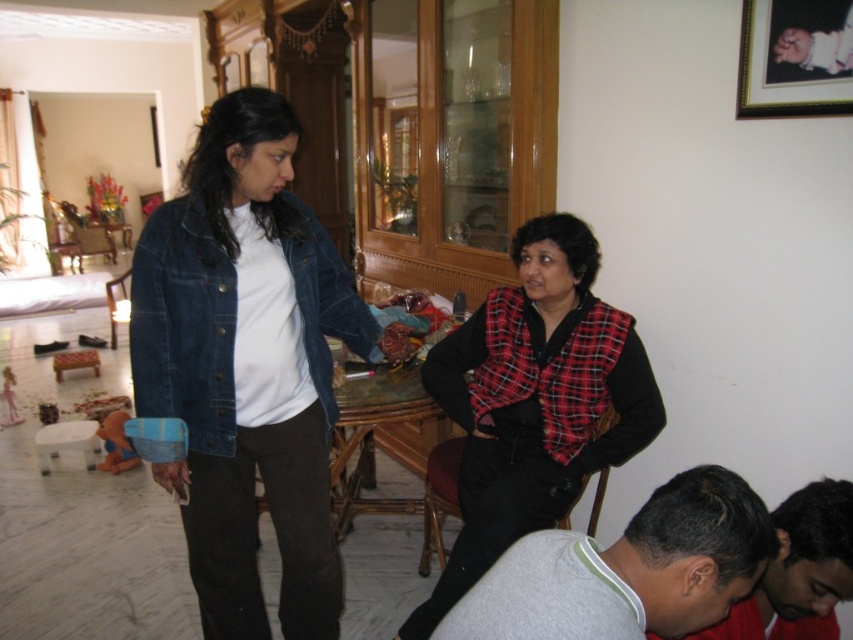
Question: Estimate the real-world distances between objects in this image. Which object is closer to the red plaid vest at center?

Choices:
 (A) denim jacket at center
 (B) gray fleece shirt at lower right

Answer: (A)

Question: Is dark gray fabric shirt at lower right to the left of white plastic stool at lower left from the viewer's perspective?

Choices:
 (A) yes
 (B) no

Answer: (B)

Question: Which object is farther from the camera taking this photo?

Choices:
 (A) denim jacket at center
 (B) dark gray fabric shirt at lower right
 (C) white plastic stool at lower left

Answer: (C)

Question: Among these points, which one is nearest to the camera?

Choices:
 (A) (74, 420)
 (B) (631, 618)
 (C) (770, 104)
 (D) (801, 531)

Answer: (B)

Question: Can you confirm if red plaid vest at center is positioned to the left of dark gray fabric shirt at lower right?

Choices:
 (A) no
 (B) yes

Answer: (B)

Question: Can you confirm if gray fleece shirt at lower right is bigger than white plastic stool at lower left?

Choices:
 (A) yes
 (B) no

Answer: (A)